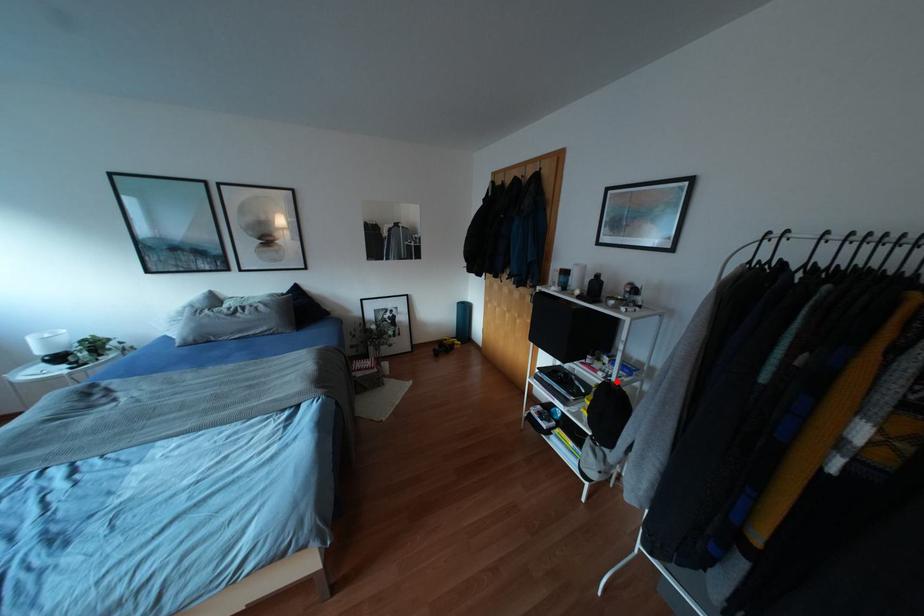
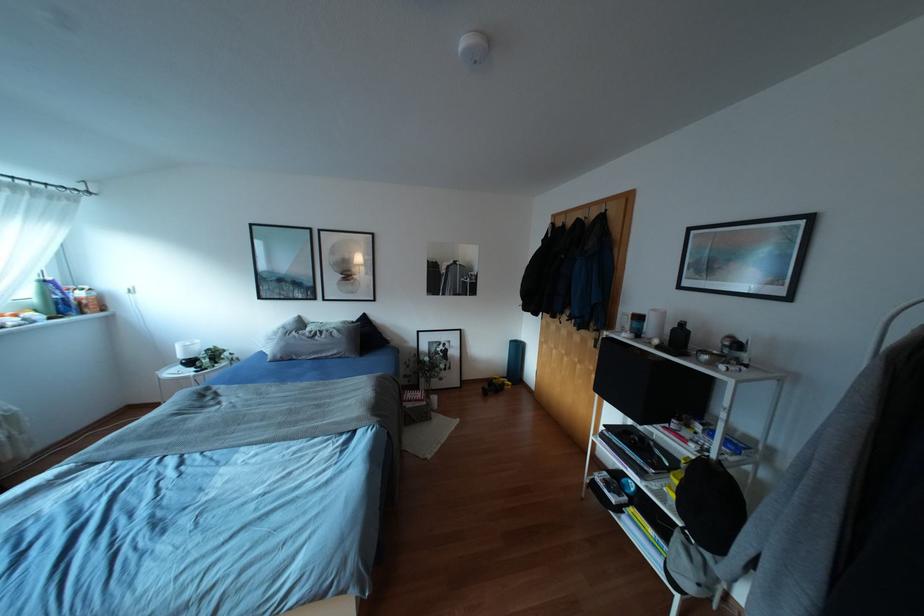
The point at the highlighted location is marked in the first image. Where is the corresponding point in the second image?

(719, 461)